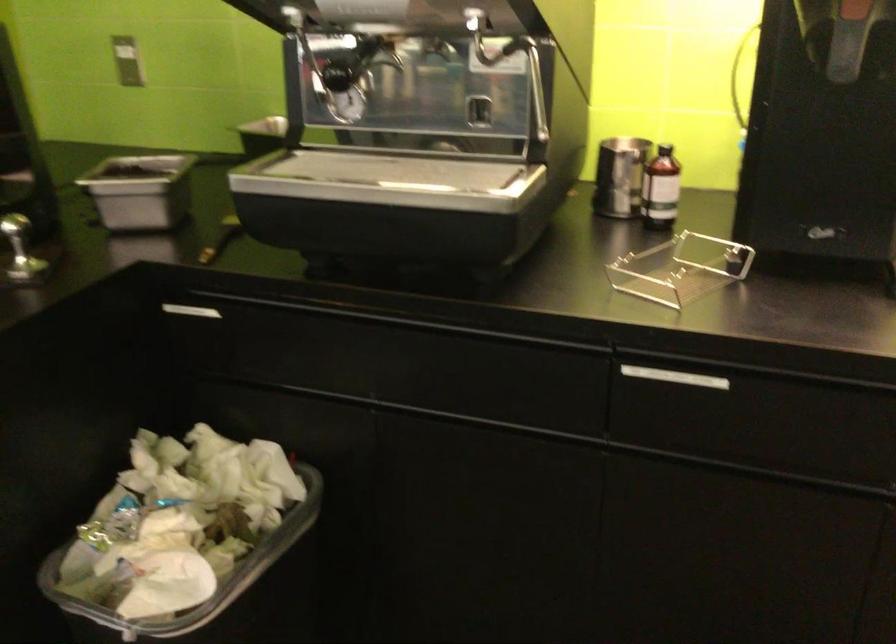
Locate an element on the screen. The height and width of the screenshot is (644, 896). clear plastic holder is located at coordinates pos(218,592).